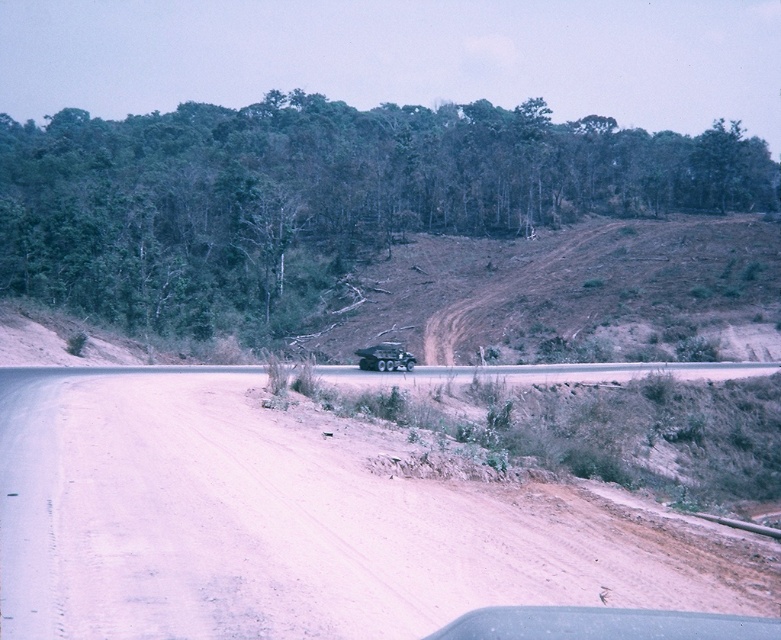
You are a photographer trying to capture the metallic green jeep at center while ensuring the green leafy tree at center doesn

The green leafy tree at center is larger in size than the metallic green jeep at center, so the tree will appear bigger in the photo.

You are a passenger in the metallic green jeep at center. You look out the window and see the green leafy tree at center. Where is the tree in relation to your view from the jeep?

The green leafy tree at center is above the metallic green jeep at center, so from the passenger seat, the tree would be visible above the jeep.